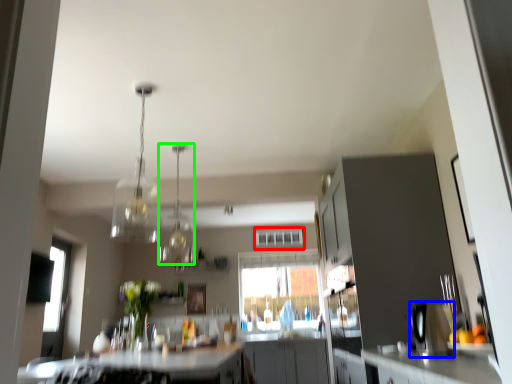
Question: Which object is the closest to the window (highlighted by a red box)? Choose among these: appliance (highlighted by a blue box) or light fixture (highlighted by a green box).

Choices:
 (A) appliance
 (B) light fixture

Answer: (B)